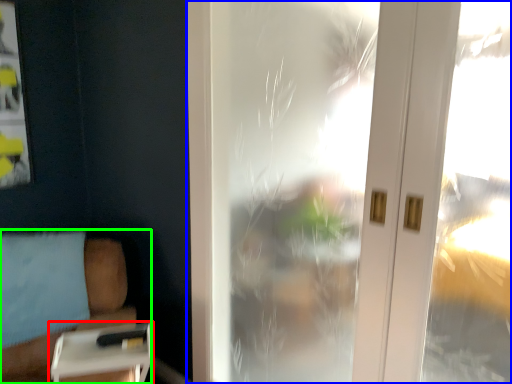
Question: Considering the real-world distances, which object is farthest from table (highlighted by a red box)? window (highlighted by a blue box) or furniture (highlighted by a green box)?

Choices:
 (A) window
 (B) furniture

Answer: (A)